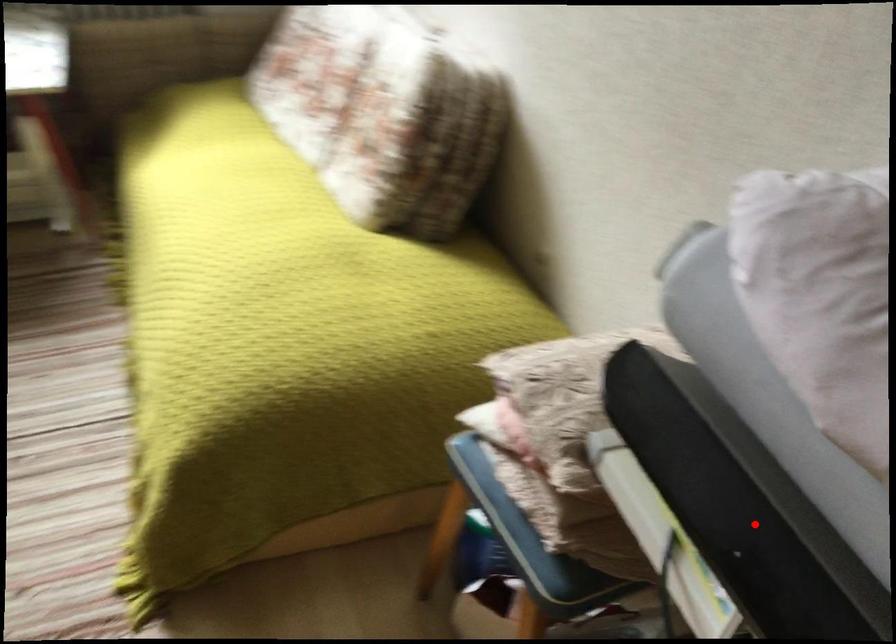
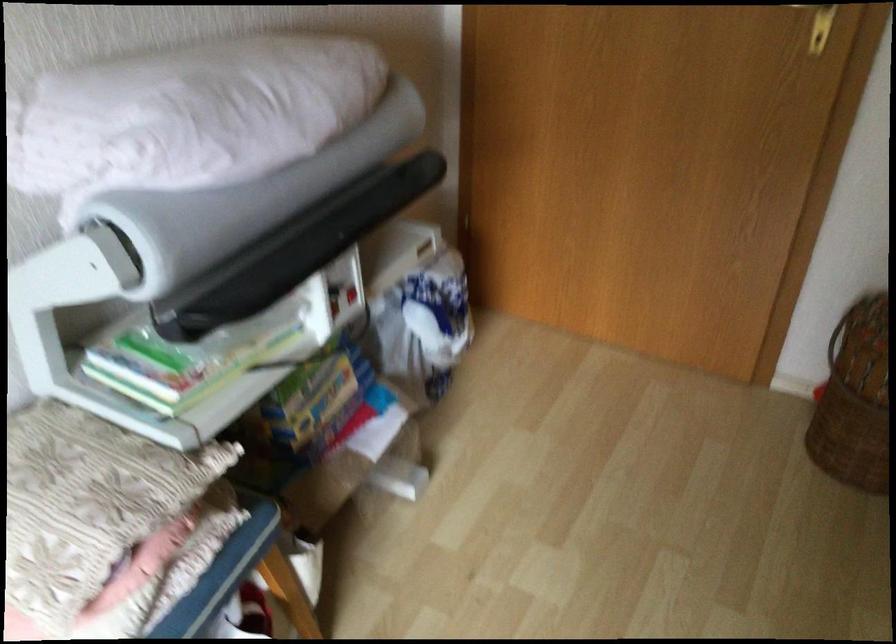
Where in the second image is the point corresponding to the highlighted location from the first image?

(295, 249)